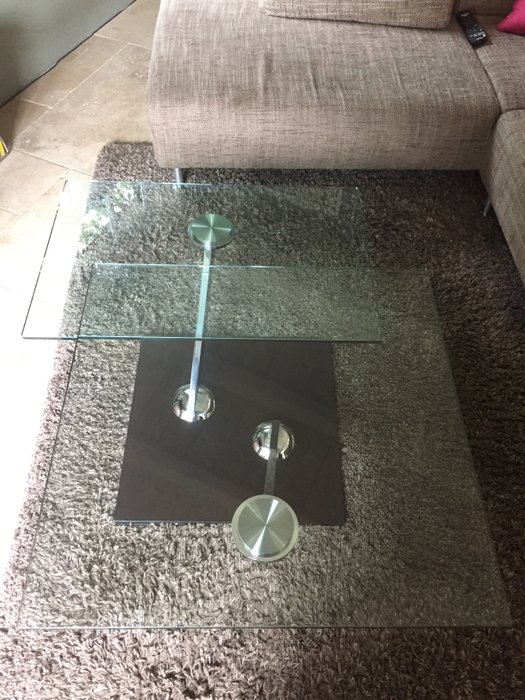
Identify the location of upper glass table top. click(x=100, y=308).